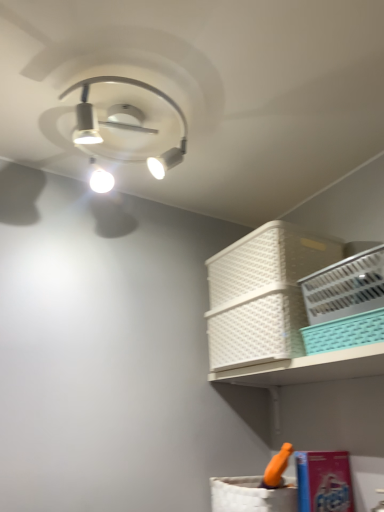
Question: Is teal plastic basket at upper right, the second basket in the front-to-back sequence, taller than white plastic basket at upper right, marked as the first basket in a front-to-back arrangement?

Choices:
 (A) yes
 (B) no

Answer: (B)

Question: Would you consider teal plastic basket at upper right, which appears as the 3th basket when viewed from the back, to be distant from white plastic basket at upper right, acting as the fourth basket starting from the back?

Choices:
 (A) yes
 (B) no

Answer: (B)

Question: Is teal plastic basket at upper right, the second basket in the front-to-back sequence, next to white plastic basket at upper right, acting as the fourth basket starting from the back, and touching it?

Choices:
 (A) yes
 (B) no

Answer: (A)

Question: From a real-world perspective, is teal plastic basket at upper right, which appears as the 3th basket when viewed from the back, physically above white plastic basket at upper right, marked as the first basket in a front-to-back arrangement?

Choices:
 (A) yes
 (B) no

Answer: (B)

Question: From the image's perspective, would you say teal plastic basket at upper right, the second basket in the front-to-back sequence, is positioned over white plastic basket at upper right, marked as the first basket in a front-to-back arrangement?

Choices:
 (A) no
 (B) yes

Answer: (A)

Question: From a real-world perspective, is white plastic basket at upper right, marked as the first basket in a front-to-back arrangement, positioned above or below teal plastic basket at upper right, which appears as the 3th basket when viewed from the back?

Choices:
 (A) above
 (B) below

Answer: (A)

Question: Relative to teal plastic basket at upper right, the second basket in the front-to-back sequence, is white plastic basket at upper right, acting as the fourth basket starting from the back, in front or behind?

Choices:
 (A) behind
 (B) front

Answer: (B)

Question: Considering the positions of white plastic basket at upper right, acting as the fourth basket starting from the back, and teal plastic basket at upper right, which appears as the 3th basket when viewed from the back, in the image, is white plastic basket at upper right, acting as the fourth basket starting from the back, taller or shorter than teal plastic basket at upper right, which appears as the 3th basket when viewed from the back,?

Choices:
 (A) short
 (B) tall

Answer: (B)

Question: Is point (380, 271) closer or farther from the camera than point (331, 344)?

Choices:
 (A) closer
 (B) farther

Answer: (A)

Question: From the image's perspective, is teal plastic basket at upper right, the second basket in the front-to-back sequence, above or below white plastic basket at upper right, acting as the fourth basket starting from the back?

Choices:
 (A) below
 (B) above

Answer: (A)

Question: Considering the positions of teal plastic basket at upper right, the second basket in the front-to-back sequence, and white plastic basket at upper right, acting as the fourth basket starting from the back, in the image, is teal plastic basket at upper right, the second basket in the front-to-back sequence, wider or thinner than white plastic basket at upper right, acting as the fourth basket starting from the back,?

Choices:
 (A) thin
 (B) wide

Answer: (B)

Question: Considering their positions, is teal plastic basket at upper right, which appears as the 3th basket when viewed from the back, located in front of or behind white plastic basket at upper right, marked as the first basket in a front-to-back arrangement?

Choices:
 (A) behind
 (B) front

Answer: (A)

Question: From their relative heights in the image, would you say teal plastic basket at upper right, the second basket in the front-to-back sequence, is taller or shorter than white plastic basket at upper right, marked as the first basket in a front-to-back arrangement?

Choices:
 (A) tall
 (B) short

Answer: (B)

Question: From a real-world perspective, is white plastic basket at upper right, marked as the first basket in a back-to-front arrangement, positioned above or below white plastic basket at upper right, acting as the fourth basket starting from the back?

Choices:
 (A) below
 (B) above

Answer: (B)

Question: Considering the positions of white plastic basket at upper right, marked as the first basket in a back-to-front arrangement, and white plastic basket at upper right, acting as the fourth basket starting from the back, in the image, is white plastic basket at upper right, marked as the first basket in a back-to-front arrangement, wider or thinner than white plastic basket at upper right, acting as the fourth basket starting from the back,?

Choices:
 (A) wide
 (B) thin

Answer: (A)